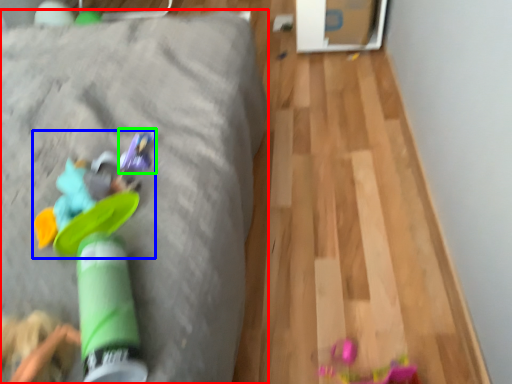
Question: Based on their relative distances, which object is nearer to furniture (highlighted by a red box)? Choose from toy (highlighted by a blue box) and toy (highlighted by a green box).

Choices:
 (A) toy
 (B) toy

Answer: (A)